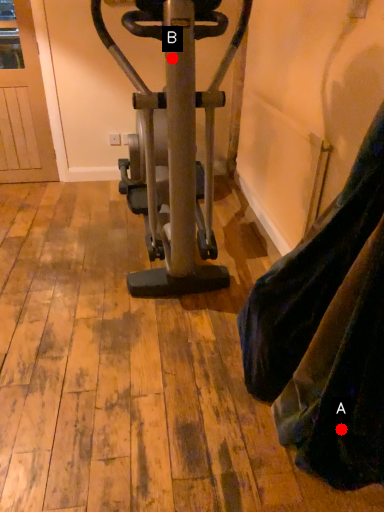
Question: Two points are circled on the image, labeled by A and B beside each circle. Which point is further to the camera?

Choices:
 (A) A is further
 (B) B is further

Answer: (B)